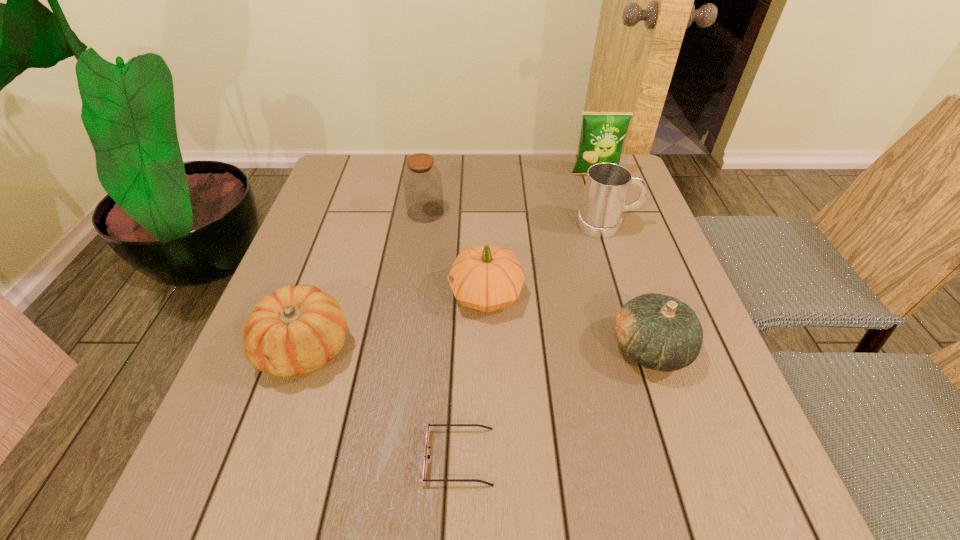
Find the location of a particular element. This screenshot has height=540, width=960. the tallest object is located at coordinates (603, 133).

Image resolution: width=960 pixels, height=540 pixels. In order to click on crisp (potato chip) in this screenshot , I will do `click(603, 133)`.

The height and width of the screenshot is (540, 960). What are the coordinates of `jar` in the screenshot? It's located at (422, 182).

The image size is (960, 540). I want to click on mug, so [x=607, y=184].

What are the coordinates of `the second gourd from right to left` in the screenshot? It's located at (486, 278).

Identify the location of the rightmost gourd. (659, 332).

The width and height of the screenshot is (960, 540). I want to click on the leftmost object, so click(x=296, y=330).

Where is `the nearest object`? The image size is (960, 540). the nearest object is located at coordinates (424, 479).

What are the coordinates of `sunglasses` in the screenshot? It's located at (424, 479).

At what (x,y) coordinates should I click in order to perform the action: click on free space located 0.250m on the front-facing side of the farthest object. Please return your answer as a coordinate pair (x, y). Image resolution: width=960 pixels, height=540 pixels. Looking at the image, I should click on (615, 234).